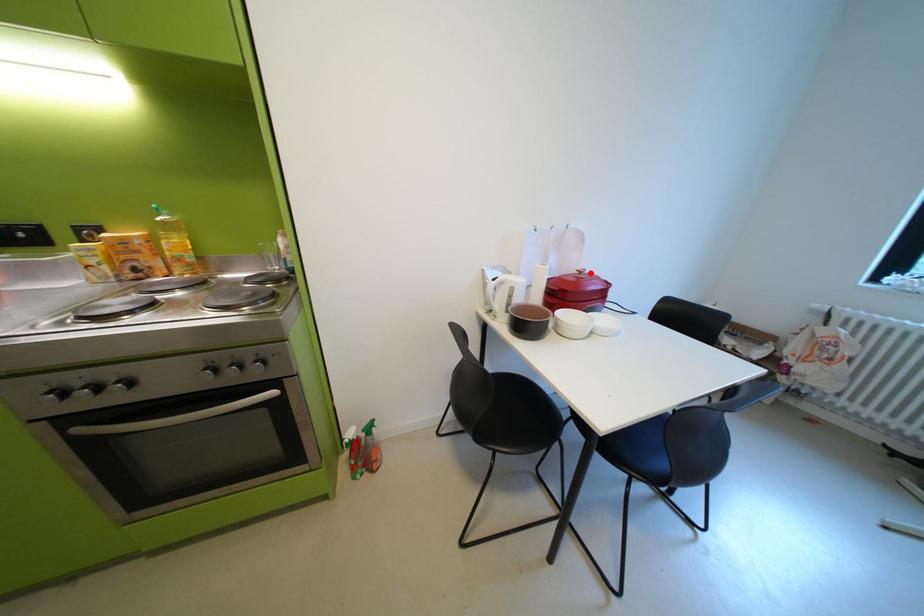
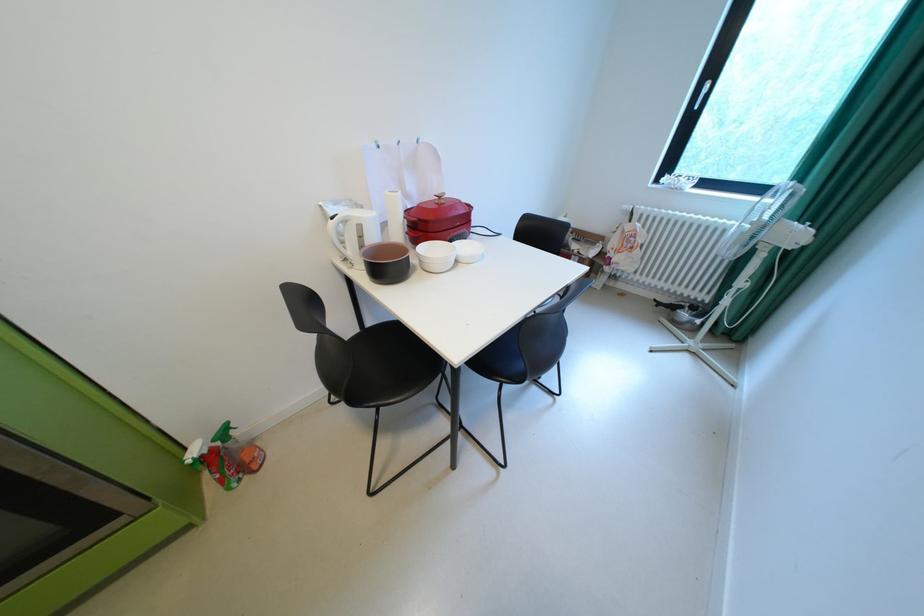
Question: A red point is marked in image1. In image2, is the corresponding 3D point closer to the camera or farther? Reply with the corresponding letter.

Choices:
 (A) The corresponding 3D point is closer.
 (B) The corresponding 3D point is farther.

Answer: (A)